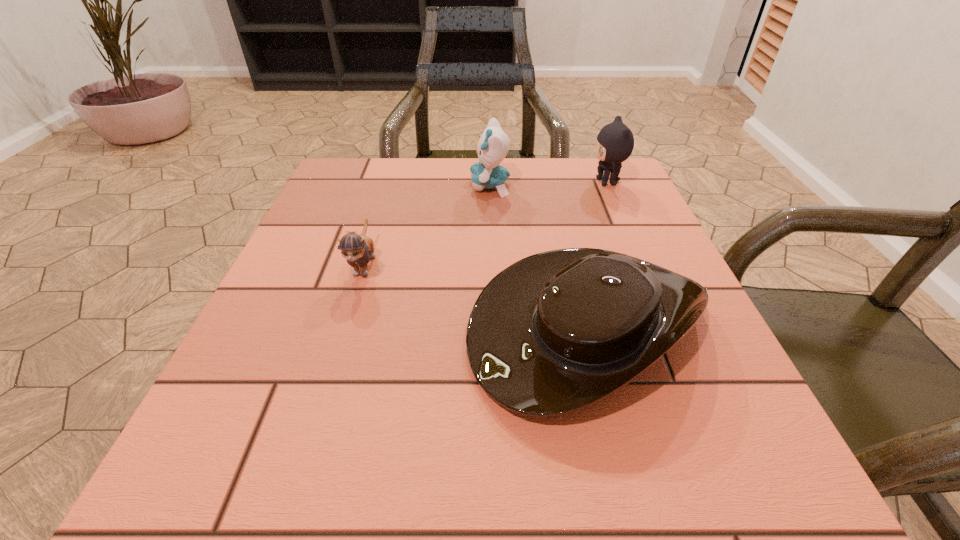
At what (x,y) coordinates should I click in order to perform the action: click on free space between the cowboy hat and the shortest kitten. Please return your answer as a coordinate pair (x, y). This screenshot has height=540, width=960. Looking at the image, I should click on (475, 294).

Locate an element on the screen. This screenshot has width=960, height=540. vacant region between the cowboy hat and the shortest kitten is located at coordinates (475, 294).

Where is `empty location between the rightmost kitten and the leftmost kitten`? The image size is (960, 540). empty location between the rightmost kitten and the leftmost kitten is located at coordinates (486, 223).

You are a GUI agent. You are given a task and a screenshot of the screen. Output one action in this format:
    pyautogui.click(x=<x>, y=<y>)
    Task: Click on the closest object to the leftmost kitten
    
    Given the screenshot: What is the action you would take?
    pyautogui.click(x=555, y=332)

Point out which object is positioned as the nearest to the second kitten from left to right. Please provide its 2D coordinates. Your answer should be formatted as a tuple, i.e. [(x, y)], where the tuple contains the x and y coordinates of a point satisfying the conditions above.

[(615, 142)]

Identify which kitten is the nearest to the second kitten from right to left. Please provide its 2D coordinates. Your answer should be formatted as a tuple, i.e. [(x, y)], where the tuple contains the x and y coordinates of a point satisfying the conditions above.

[(615, 142)]

At what (x,y) coordinates should I click in order to perform the action: click on kitten that is the second closest to the cowboy hat. Please return your answer as a coordinate pair (x, y). Image resolution: width=960 pixels, height=540 pixels. Looking at the image, I should click on point(615,142).

Locate an element on the screen. The image size is (960, 540). free space that satisfies the following two spatial constraints: 1. on the front-facing side of the cowboy hat; 2. on the left side of the nearest kitten is located at coordinates (346, 324).

This screenshot has width=960, height=540. In order to click on vacant area in the image that satisfies the following two spatial constraints: 1. on the face of the second kitten from right to left; 2. on the back side of the cowboy hat in this screenshot , I will do pos(494,324).

You are a GUI agent. You are given a task and a screenshot of the screen. Output one action in this format:
    pyautogui.click(x=<x>, y=<y>)
    Task: Click on the free spot that satisfies the following two spatial constraints: 1. on the face of the second kitten from left to right; 2. on the left side of the cowboy hat
    Image resolution: width=960 pixels, height=540 pixels.
    Given the screenshot: What is the action you would take?
    pyautogui.click(x=494, y=324)